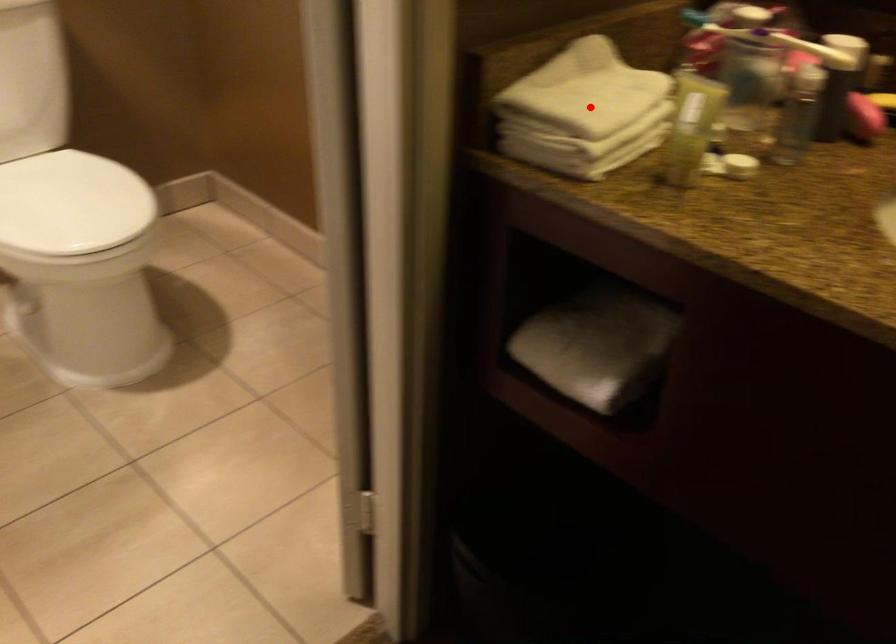
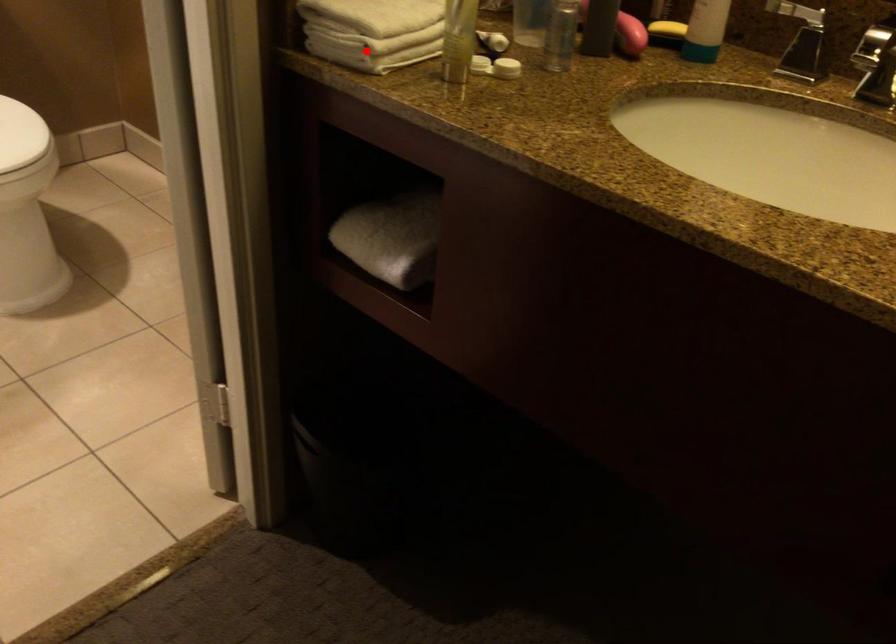
I am providing you with two images of the same scene from different viewpoints. A red point is marked on the first image and another point is marked on the second image. Do the highlighted points in image1 and image2 indicate the same real-world spot?

No